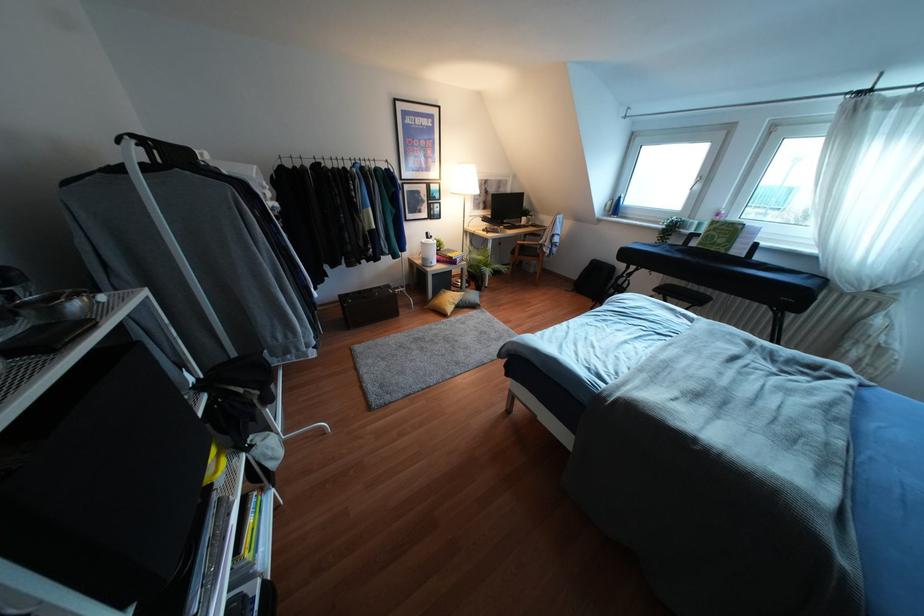
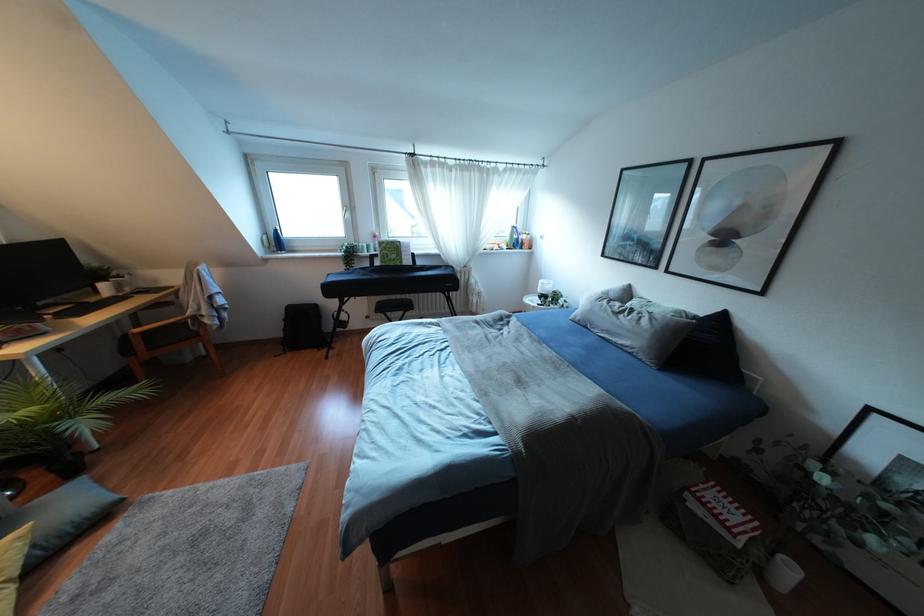
Locate, in the second image, the point that corresponds to (614,208) in the first image.

(275, 241)